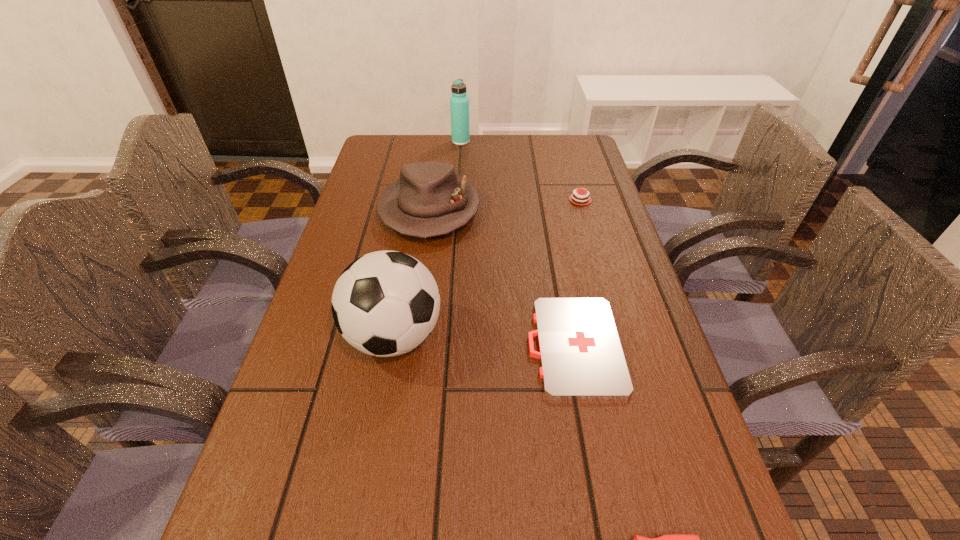
Find the location of a particular element. The width and height of the screenshot is (960, 540). vacant space situated on handle side the shortest object is located at coordinates (499, 346).

Where is `vacant space situated 0.070m on handle side the shortest object`? vacant space situated 0.070m on handle side the shortest object is located at coordinates pyautogui.click(x=494, y=346).

Where is `object that is at the far edge`? The height and width of the screenshot is (540, 960). object that is at the far edge is located at coordinates (459, 102).

Identify the location of soccer ball that is positioned at the left edge. The image size is (960, 540). (386, 303).

Image resolution: width=960 pixels, height=540 pixels. I want to click on hat located in the left edge section of the desktop, so click(x=429, y=199).

Where is `chocolate cake that is at the right edge`? Image resolution: width=960 pixels, height=540 pixels. chocolate cake that is at the right edge is located at coordinates (576, 198).

The image size is (960, 540). Find the location of `the first-aid kit at the right edge`. the first-aid kit at the right edge is located at coordinates (x=581, y=356).

The width and height of the screenshot is (960, 540). I want to click on vacant space at the far edge, so click(x=538, y=163).

In the image, there is a desktop. Identify the location of vacant region at the left edge. The width and height of the screenshot is (960, 540). (300, 406).

At what (x,y) coordinates should I click in order to perform the action: click on vacant region at the right edge of the desktop. Please return your answer as a coordinate pair (x, y). Looking at the image, I should click on (652, 370).